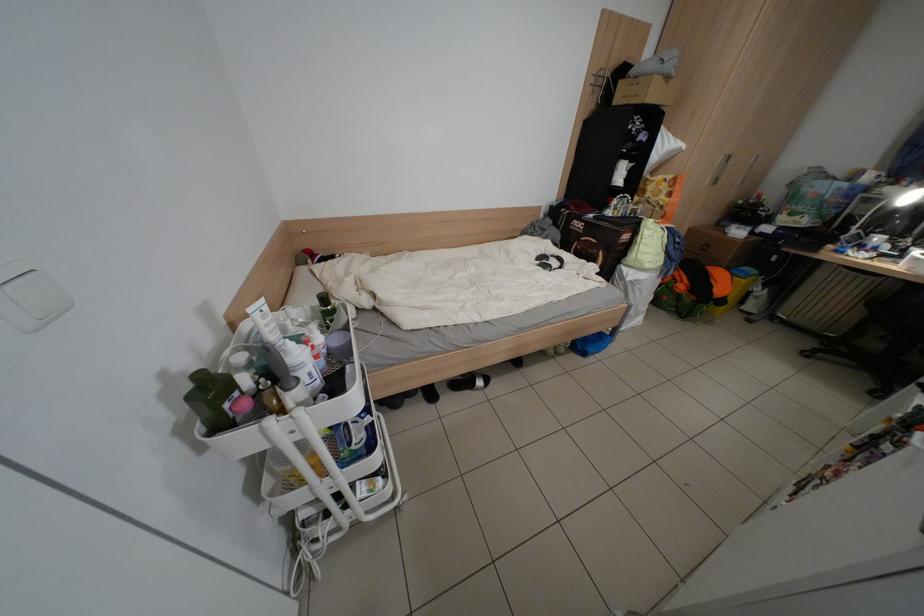
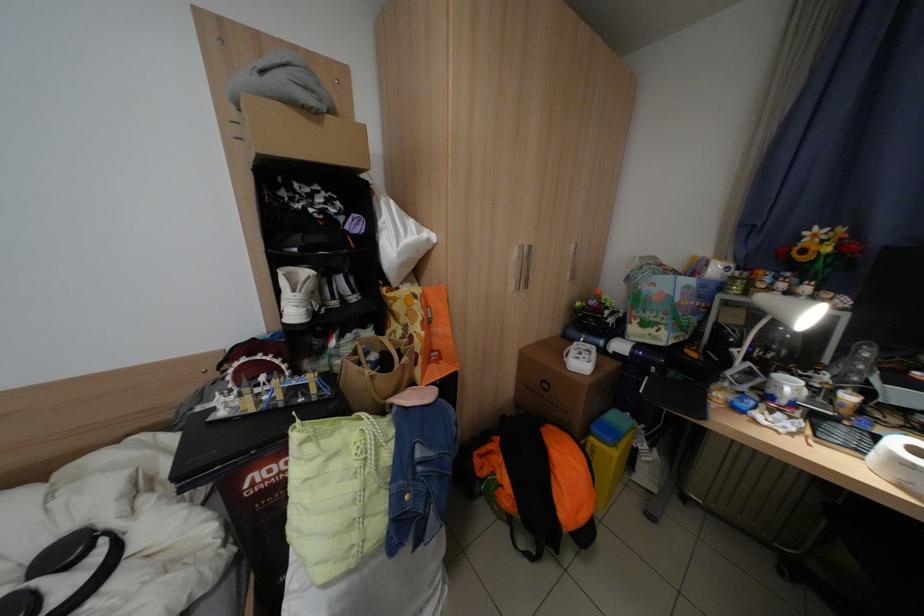
Find the pixel in the second image that matches [867,233] in the first image.

(752, 366)